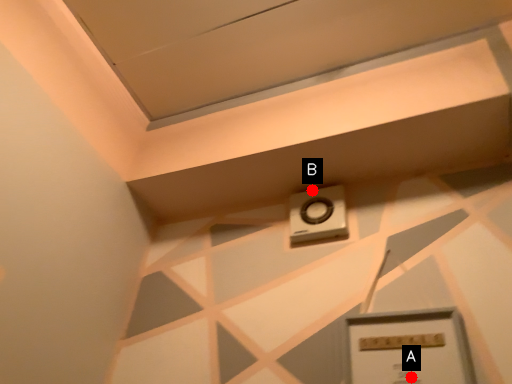
Question: Two points are circled on the image, labeled by A and B beside each circle. Which of the following is the closest to the observer?

Choices:
 (A) A is closer
 (B) B is closer

Answer: (A)